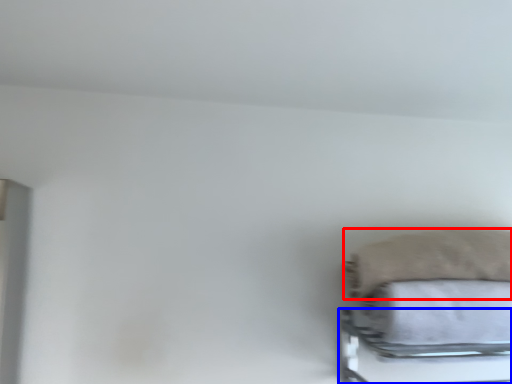
Question: Among these objects, which one is nearest to the camera, pillow (highlighted by a red box) or bed frame (highlighted by a blue box)?

Choices:
 (A) pillow
 (B) bed frame

Answer: (B)